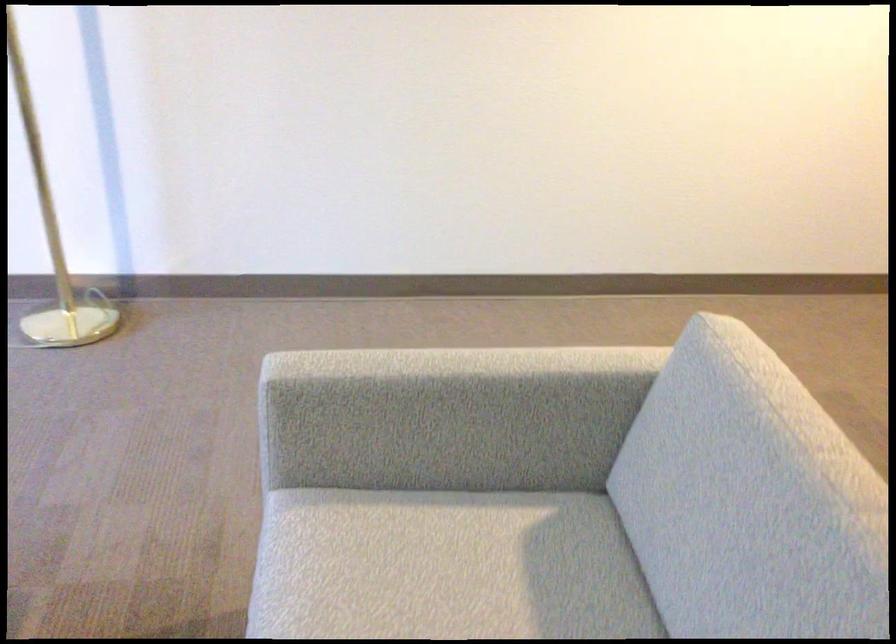
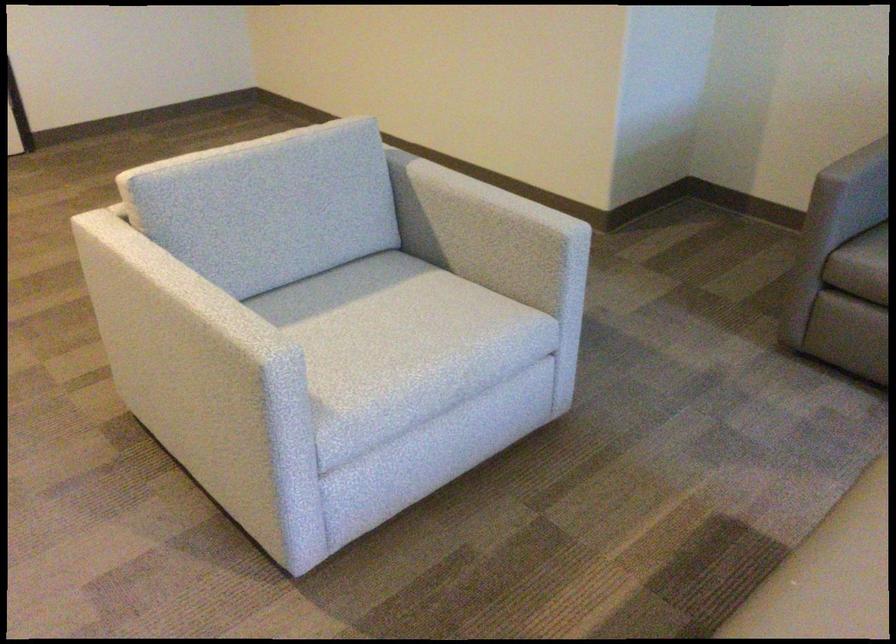
In the second image, find the point that corresponds to point 453,368 in the first image.

(195, 294)